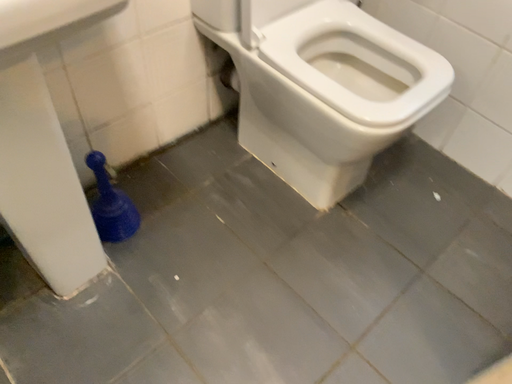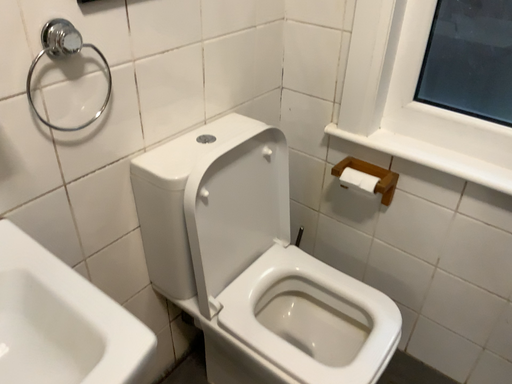
Question: Which way did the camera rotate in the video?

Choices:
 (A) rotated downward
 (B) rotated upward

Answer: (B)